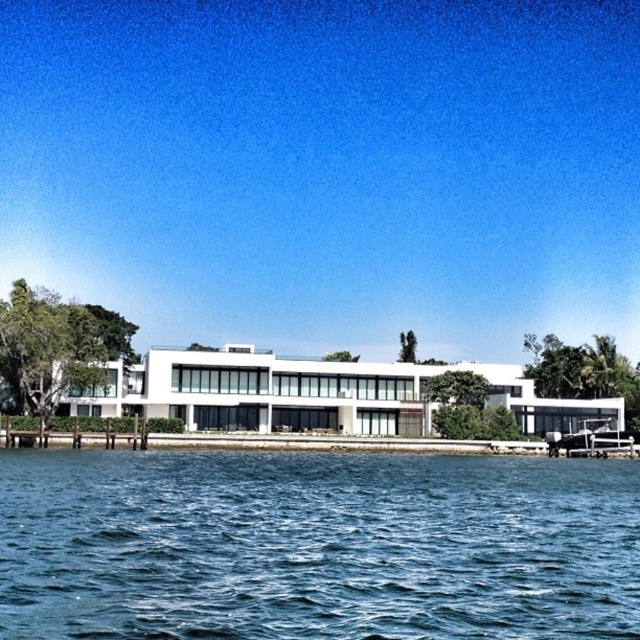
Question: Can you confirm if blue water at lower center is thinner than metallic silver boat at right?

Choices:
 (A) no
 (B) yes

Answer: (A)

Question: Which of the following is the closest to the observer?

Choices:
 (A) blue water at lower center
 (B) metallic silver boat at right

Answer: (A)

Question: Does blue water at lower center appear on the left side of metallic silver boat at right?

Choices:
 (A) yes
 (B) no

Answer: (A)

Question: Does blue water at lower center have a larger size compared to metallic silver boat at right?

Choices:
 (A) no
 (B) yes

Answer: (B)

Question: Which of the following is the farthest from the observer?

Choices:
 (A) (600, 492)
 (B) (586, 444)

Answer: (B)